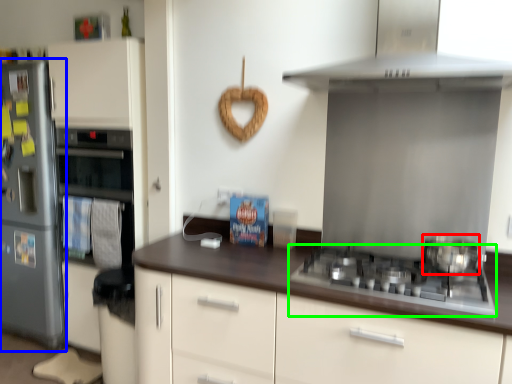
Question: Considering the real-world distances, which object is closest to kitchen appliance (highlighted by a red box)? refrigerator (highlighted by a blue box) or gas stove (highlighted by a green box).

Choices:
 (A) refrigerator
 (B) gas stove

Answer: (B)